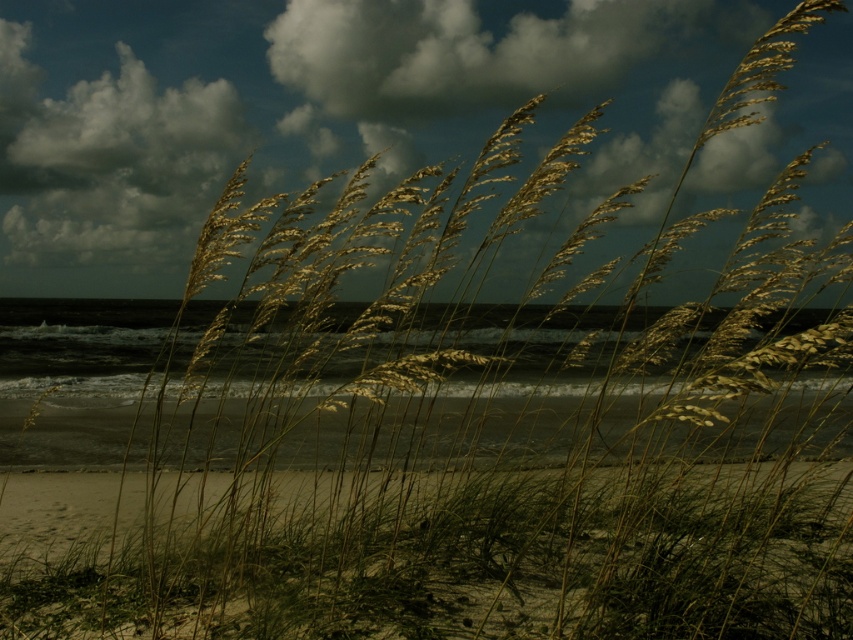
Question: Is cloudy sky at upper center to the left of smooth sand at lower center from the viewer's perspective?

Choices:
 (A) yes
 (B) no

Answer: (A)

Question: Which of the following is the closest to the observer?

Choices:
 (A) (689, 188)
 (B) (737, 605)

Answer: (B)

Question: Is cloudy sky at upper center to the left of smooth sand at lower center from the viewer's perspective?

Choices:
 (A) yes
 (B) no

Answer: (A)

Question: Does cloudy sky at upper center appear over smooth sand at lower center?

Choices:
 (A) yes
 (B) no

Answer: (A)